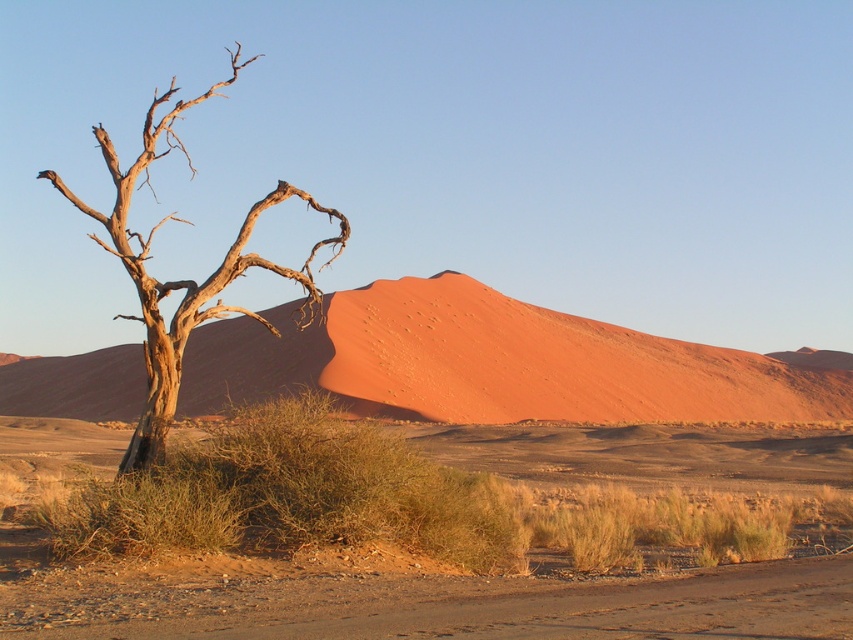
Question: Is green shrub at center further to camera compared to dead brown wood at left?

Choices:
 (A) yes
 (B) no

Answer: (B)

Question: Is green shrub at center below dead brown wood at left?

Choices:
 (A) yes
 (B) no

Answer: (A)

Question: Which point is farther from the camera taking this photo?

Choices:
 (A) (175, 630)
 (B) (71, 552)

Answer: (B)

Question: Which object is positioned closest to the dead brown wood at left?

Choices:
 (A) dusty gravel road at lower center
 (B) sandy orange dune at center
 (C) green shrub at center

Answer: (B)

Question: Among these objects, which one is farthest from the camera?

Choices:
 (A) sandy orange dune at center
 (B) green shrub at center
 (C) dusty gravel road at lower center
 (D) dead brown wood at left

Answer: (A)

Question: Considering the relative positions of sandy orange dune at center and dead brown wood at left in the image provided, where is sandy orange dune at center located with respect to dead brown wood at left?

Choices:
 (A) above
 (B) below

Answer: (B)